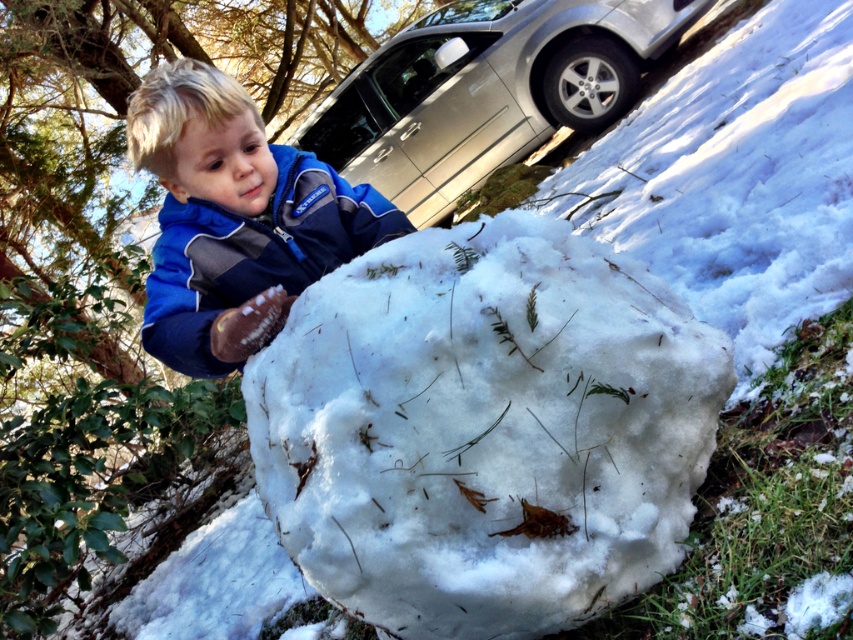
Question: Is green leafy tree at center wider than silver metallic car at upper center?

Choices:
 (A) no
 (B) yes

Answer: (B)

Question: Is green leafy tree at center to the right of blue fleece jacket at center from the viewer's perspective?

Choices:
 (A) yes
 (B) no

Answer: (B)

Question: Which point is closer to the camera?

Choices:
 (A) (363, 61)
 (B) (440, 506)
 (C) (16, 444)
 (D) (138, 141)

Answer: (B)

Question: Is green leafy tree at center further to camera compared to silver metallic car at upper center?

Choices:
 (A) yes
 (B) no

Answer: (B)

Question: Which point is closer to the camera taking this photo?

Choices:
 (A) (151, 150)
 (B) (421, 442)

Answer: (B)

Question: Based on their relative distances, which object is farther from the silver metallic car at upper center?

Choices:
 (A) white fluffy mound at center
 (B) green leafy tree at center

Answer: (A)